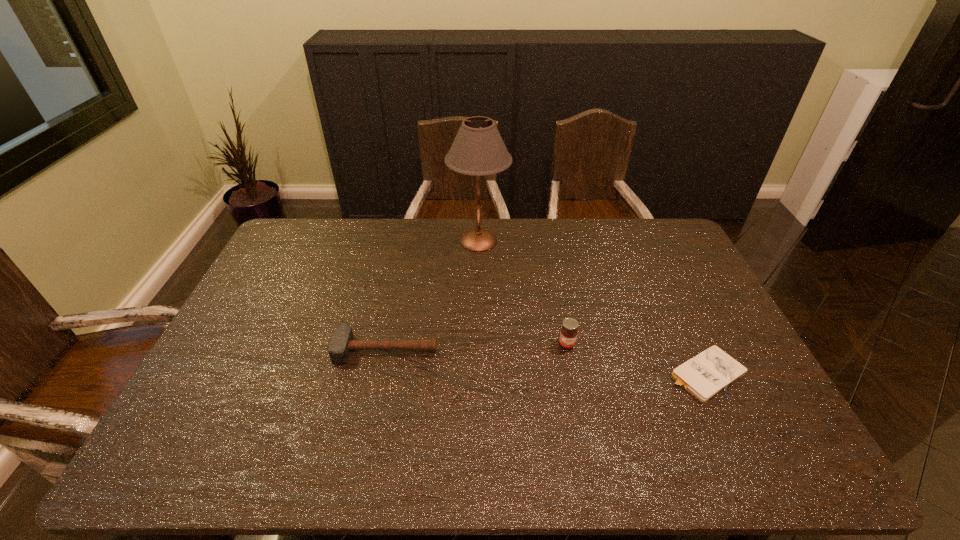
Locate an element on the screen. The image size is (960, 540). the farthest object is located at coordinates (478, 149).

The height and width of the screenshot is (540, 960). Identify the location of the second object from left to right. (478, 149).

The height and width of the screenshot is (540, 960). I want to click on jam, so click(x=568, y=334).

You are a GUI agent. You are given a task and a screenshot of the screen. Output one action in this format:
    pyautogui.click(x=<x>, y=<y>)
    Task: Click on the second tallest object
    
    Given the screenshot: What is the action you would take?
    pyautogui.click(x=568, y=334)

Find the location of `the second shortest object`. the second shortest object is located at coordinates (342, 342).

Find the location of a particular element. The image size is (960, 540). hammer is located at coordinates (342, 342).

The image size is (960, 540). Find the location of `notebook`. notebook is located at coordinates (704, 376).

I want to click on the shortest object, so click(x=704, y=376).

The height and width of the screenshot is (540, 960). Identify the location of free space located on the front-facing side of the table lamp. (581, 240).

You are a GUI agent. You are given a task and a screenshot of the screen. Output one action in this format:
    pyautogui.click(x=<x>, y=<y>)
    Task: Click on the free spot located 0.190m on the label side of the third shortest object
    
    Given the screenshot: What is the action you would take?
    pyautogui.click(x=580, y=410)